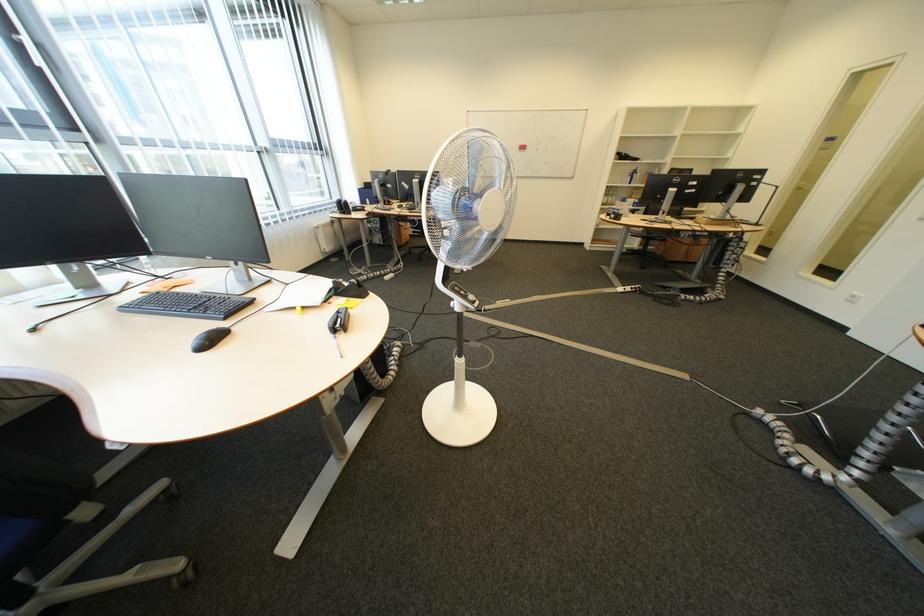
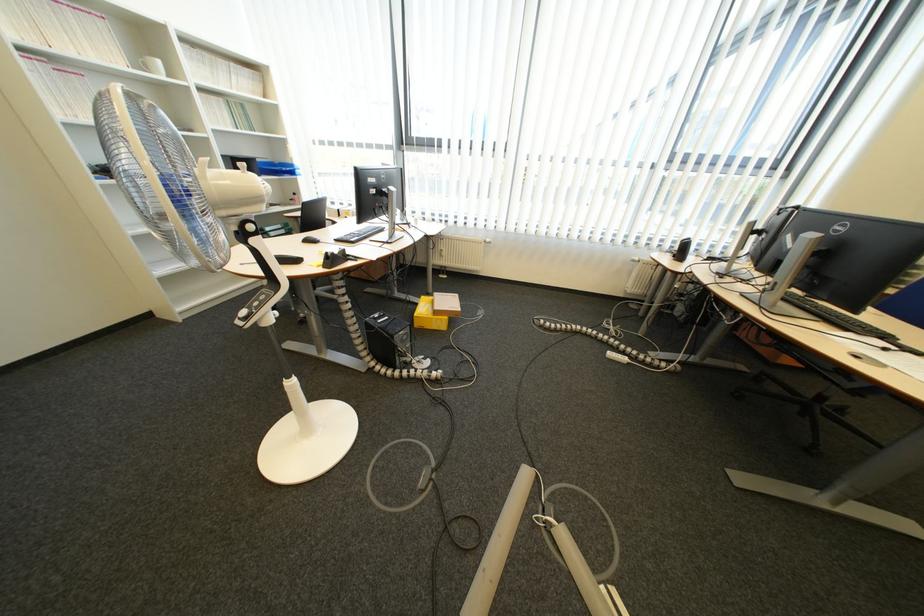
The point at (406, 270) is marked in the first image. Where is the corresponding point in the second image?

(654, 358)